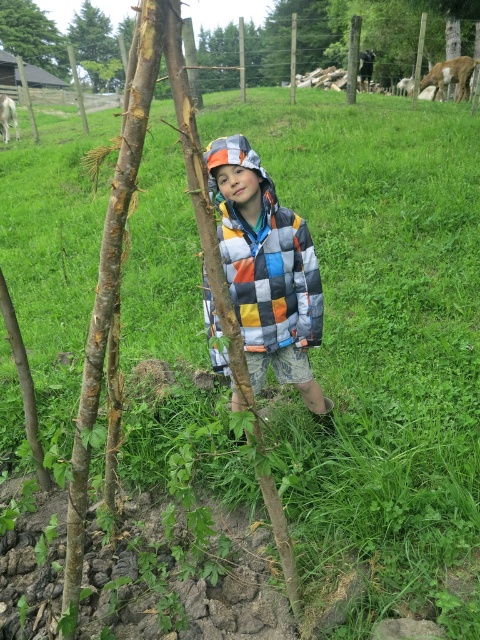
Question: Based on their relative distances, which object is nearer to the patchwork quilted jacket at center?

Choices:
 (A) smooth brown tree trunk at upper left
 (B) brown fur goat at upper right
 (C) green textured tree at upper left
 (D) white woolen sweater at upper left

Answer: (B)

Question: Is smooth brown tree trunk at upper left smaller than brown fur goat at upper right?

Choices:
 (A) no
 (B) yes

Answer: (B)

Question: Which is nearer to the white woolen sweater at upper left?

Choices:
 (A) brown fur goat at upper right
 (B) patchwork quilted jacket at center
 (C) smooth brown tree trunk at upper left

Answer: (A)

Question: Which of the following is the closest to the observer?

Choices:
 (A) (207, 157)
 (B) (468, 81)

Answer: (A)

Question: Is green textured tree at upper left bigger than brown fur goat at upper right?

Choices:
 (A) no
 (B) yes

Answer: (A)

Question: Considering the relative positions of patchwork quilted jacket at center and green textured tree at upper left in the image provided, where is patchwork quilted jacket at center located with respect to green textured tree at upper left?

Choices:
 (A) left
 (B) right

Answer: (B)